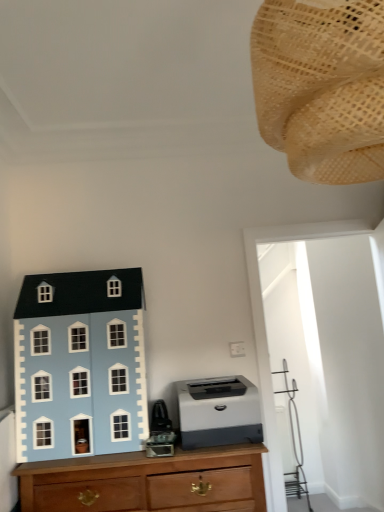
Question: Is woven beige lampshade at upper right, acting as the second toy starting from the left, at the back of wooden chest of drawers at lower left?

Choices:
 (A) yes
 (B) no

Answer: (B)

Question: Considering the relative sizes of wooden chest of drawers at lower left and woven beige lampshade at upper right, which appears as the second toy when ordered from the bottom, in the image provided, is wooden chest of drawers at lower left wider than woven beige lampshade at upper right, which appears as the second toy when ordered from the bottom,?

Choices:
 (A) yes
 (B) no

Answer: (A)

Question: Is the position of wooden chest of drawers at lower left more distant than that of woven beige lampshade at upper right, the first toy viewed from the top?

Choices:
 (A) yes
 (B) no

Answer: (A)

Question: Can you see wooden chest of drawers at lower left touching woven beige lampshade at upper right, acting as the second toy starting from the left?

Choices:
 (A) no
 (B) yes

Answer: (A)

Question: Is woven beige lampshade at upper right, which is counted as the first toy, starting from the right, surrounded by wooden chest of drawers at lower left?

Choices:
 (A) no
 (B) yes

Answer: (A)

Question: Is wooden chest of drawers at lower left to the left of woven beige lampshade at upper right, which appears as the second toy when ordered from the bottom, from the viewer's perspective?

Choices:
 (A) no
 (B) yes

Answer: (B)

Question: Is the depth of woven beige lampshade at upper right, which is counted as the first toy, starting from the right, greater than that of wooden chest of drawers at lower left?

Choices:
 (A) yes
 (B) no

Answer: (B)

Question: Are woven beige lampshade at upper right, which appears as the second toy when ordered from the bottom, and wooden chest of drawers at lower left making contact?

Choices:
 (A) yes
 (B) no

Answer: (B)

Question: Is woven beige lampshade at upper right, which appears as the second toy when ordered from the bottom, bigger than wooden chest of drawers at lower left?

Choices:
 (A) no
 (B) yes

Answer: (A)

Question: Does woven beige lampshade at upper right, the first toy viewed from the top, have a greater width compared to wooden chest of drawers at lower left?

Choices:
 (A) no
 (B) yes

Answer: (A)

Question: Can you confirm if woven beige lampshade at upper right, which is counted as the first toy, starting from the right, is positioned to the left of wooden chest of drawers at lower left?

Choices:
 (A) yes
 (B) no

Answer: (B)

Question: Does woven beige lampshade at upper right, which is counted as the first toy, starting from the right, appear on the right side of wooden chest of drawers at lower left?

Choices:
 (A) no
 (B) yes

Answer: (B)

Question: Can you confirm if light blue matte dollhouse at left, which appears as the second toy when viewed from the top, is wider than wooden chest of drawers at lower left?

Choices:
 (A) no
 (B) yes

Answer: (A)